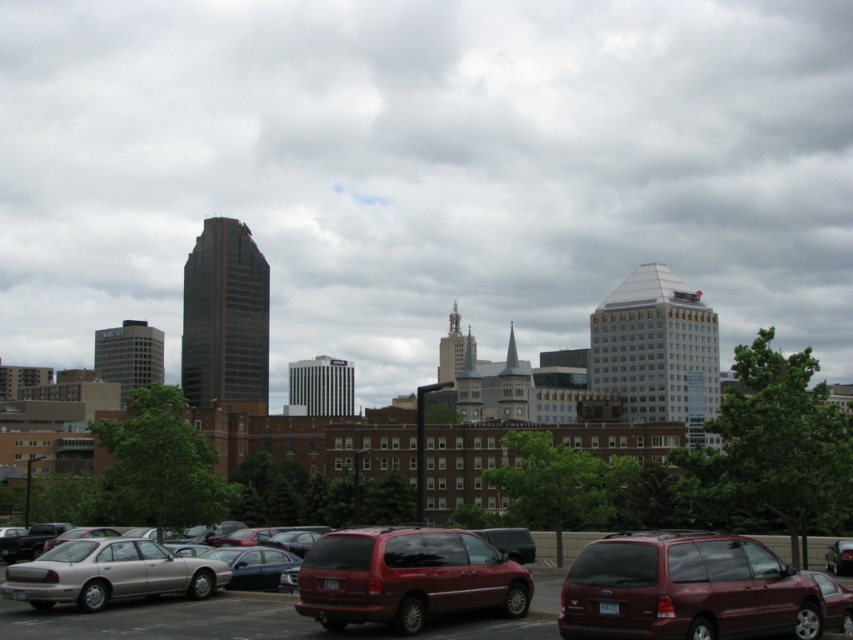
You are standing in the parking lot and see the shiny maroon minivan at center and the silver metallic sedan at lower left. Which vehicle is positioned to the right side of the other?

The shiny maroon minivan at center is positioned to the right of the silver metallic sedan at lower left.